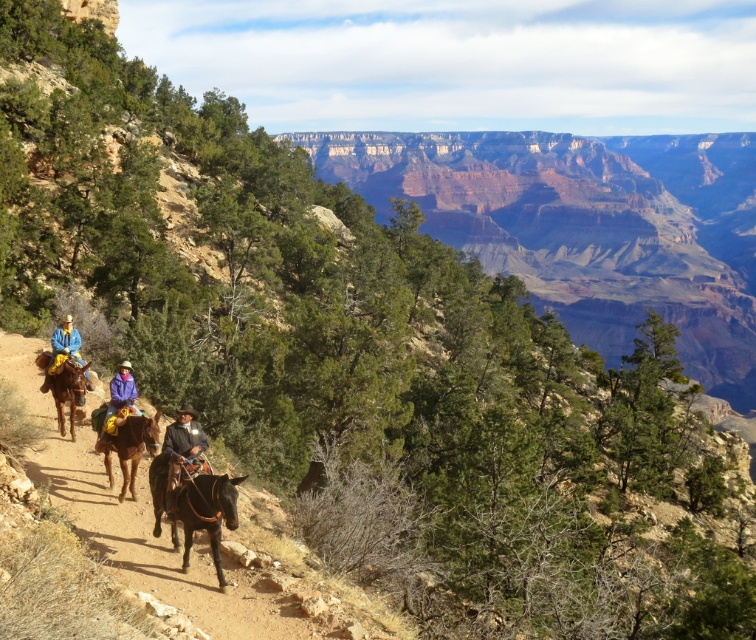
You are a photographer standing at the edge of the Grand Canyon. You see a brown fuzzy horse at center and a brown leather jacket at center. Which object is taller? Please answer based on the scene description.

The brown fuzzy horse at center is taller than the brown leather jacket at center.

You are a photographer standing at the edge of the Grand Canyon. You see a brown fuzzy horse at center and a brown leather jacket at center. Which object is higher in the image?

The brown fuzzy horse at center is above the brown leather jacket at center, so the brown fuzzy horse at center is higher in the image.